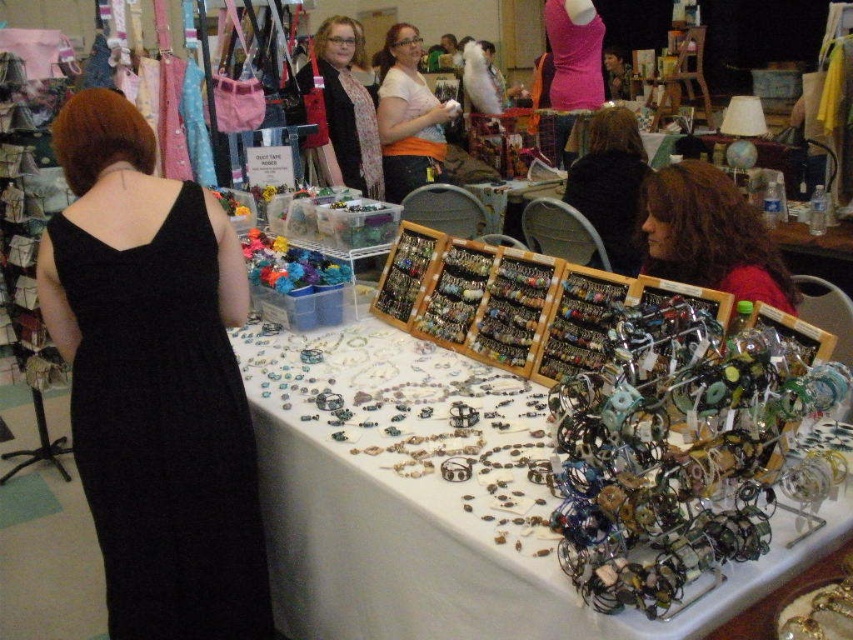
You are a customer at the market and want to examine the metallic wire bracelets at center. However, you notice the white matte shirt at center is blocking your view. Which object should you move to get a better look at the bracelets?

To get a better look at the metallic wire bracelets at center, you should move the white matte shirt at center since the bracelets are positioned to the right of it, allowing you to see them once the shirt is out of the way.

You are a customer at the market and want to examine the metallic wire bracelets at center. However, the shiny brown hair at center of the woman is blocking your view. Can you see the bracelets clearly?

Yes, because the metallic wire bracelets at center are closer to the viewer than the shiny brown hair at center, so the bracelets are in front of the hair and visible.